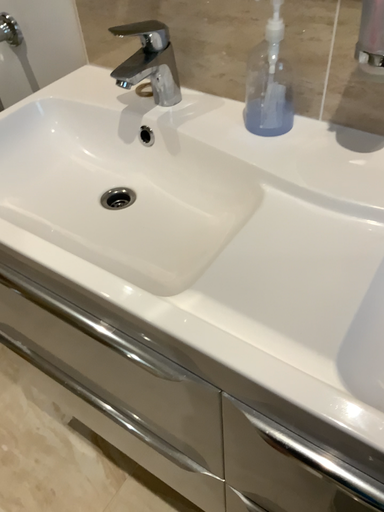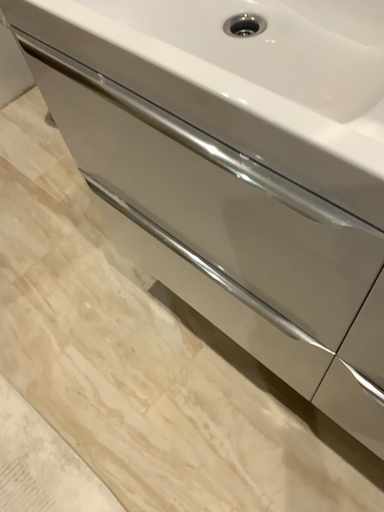
Question: Which way did the camera rotate in the video?

Choices:
 (A) rotated downward
 (B) rotated upward

Answer: (A)